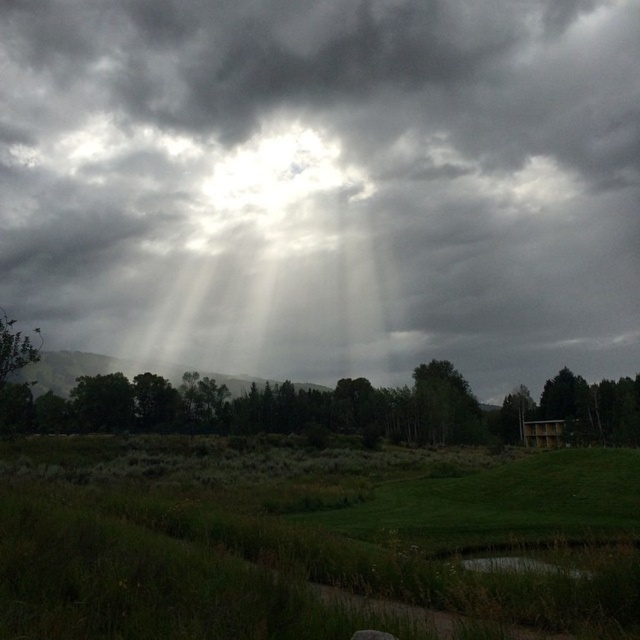
Consider the image. Which is more to the right, green grass at center or green matte tree at center?

green matte tree at center is more to the right.

Find the location of `green grass at center`. green grass at center is located at coordinates (304, 538).

Identify the location of green grass at center. The height and width of the screenshot is (640, 640). (304, 538).

Between point (456, 400) and point (588, 390), which one is positioned in front?

Point (588, 390)

Is point (442, 378) less distant than point (588, 406)?

No, (442, 378) is behind (588, 406).

Locate an element on the screen. green matte tree at center is located at coordinates (445, 404).

Between point (61, 557) and point (572, 442), which one is positioned behind?

Point (572, 442)

Is green grass at center to the right of green matte tree at lower right from the viewer's perspective?

In fact, green grass at center is to the left of green matte tree at lower right.

Is point (4, 516) positioned after point (573, 436)?

No, it is not.

Identify the location of green grass at center. The image size is (640, 640). (304, 538).